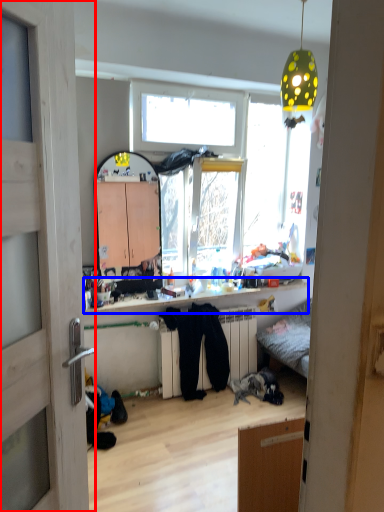
Question: Which object appears closest to the camera in this image, door (highlighted by a red box) or counter top (highlighted by a blue box)?

Choices:
 (A) door
 (B) counter top

Answer: (A)